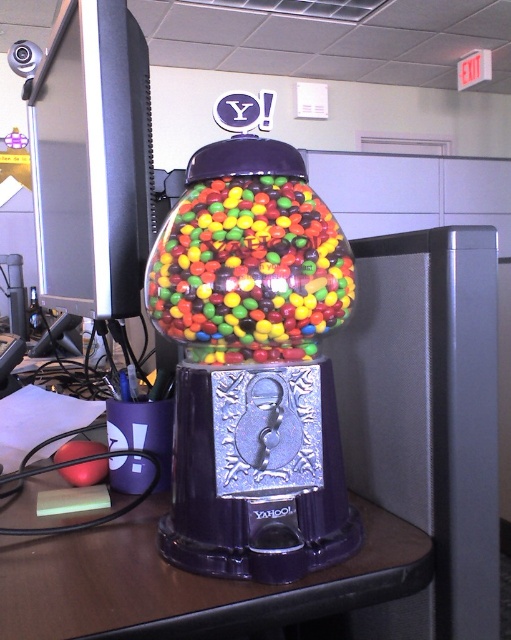
Is purple glossy table at center shorter than shiny multicolored gumballs at center?

Yes.

Which is behind, point (138, 515) or point (153, 273)?

Point (138, 515)

Which is in front, point (374, 573) or point (289, 339)?

Point (374, 573) is more forward.

Where is `purple glossy table at center`? purple glossy table at center is located at coordinates (183, 582).